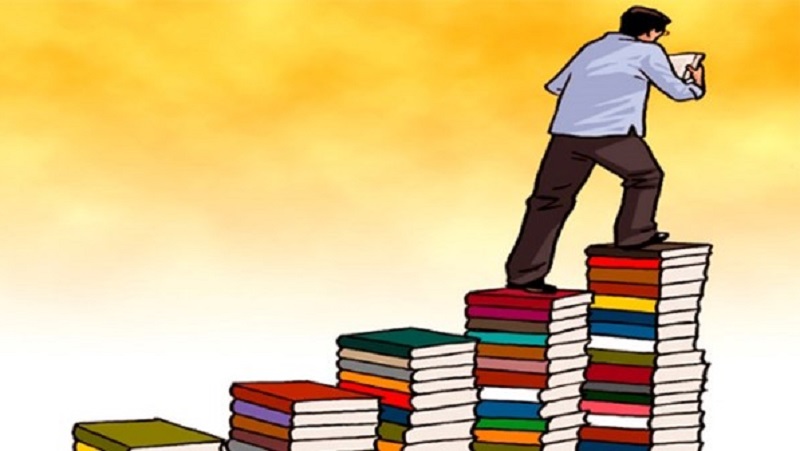
Image resolution: width=800 pixels, height=451 pixels. What are the coordinates of `red books` in the screenshot? It's located at (293, 400), (410, 402), (536, 306), (514, 381), (637, 438), (642, 374), (652, 294), (654, 269).